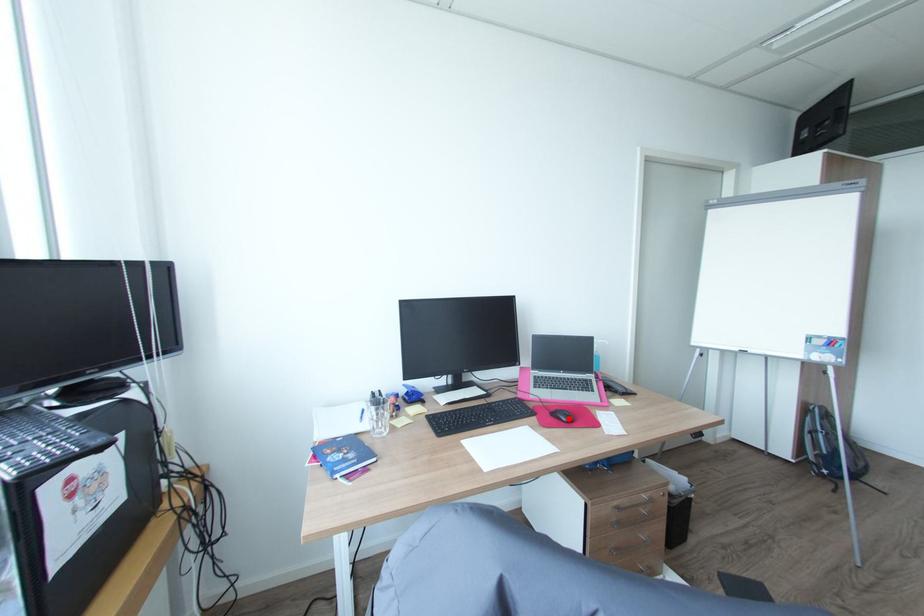
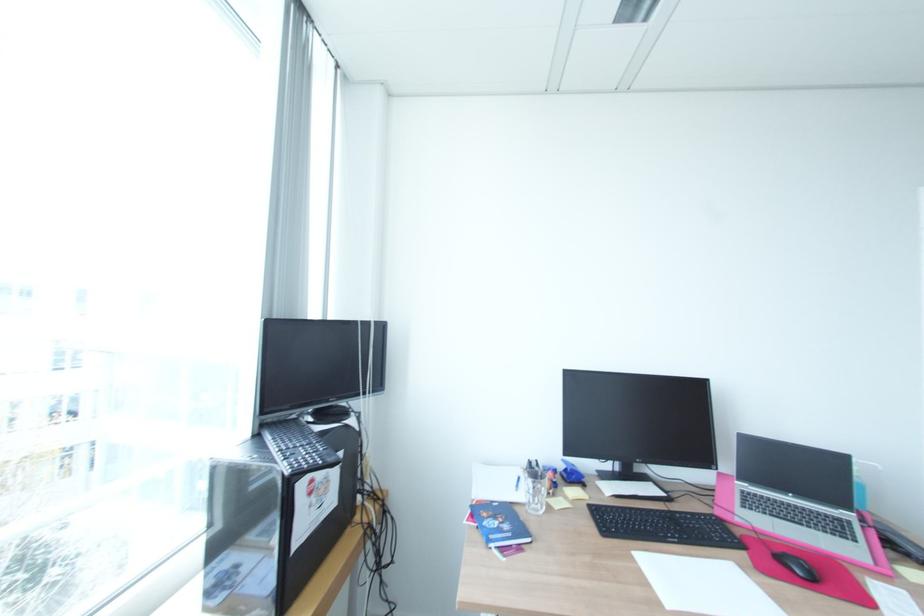
Locate, in the second image, the point that corresponds to the highlighted location in the first image.

(804, 572)